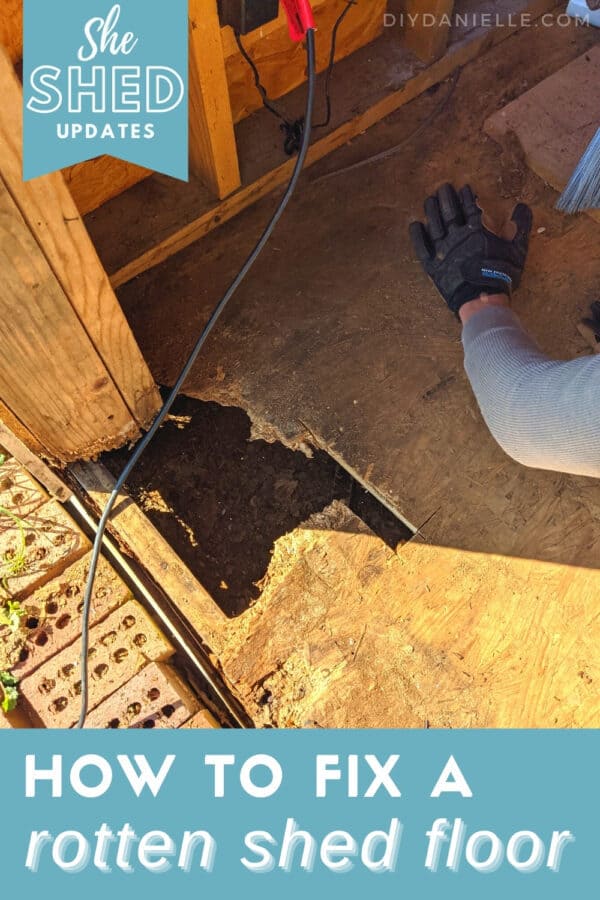
Where is `electrical outlet`? Image resolution: width=600 pixels, height=900 pixels. electrical outlet is located at coordinates click(x=244, y=14).